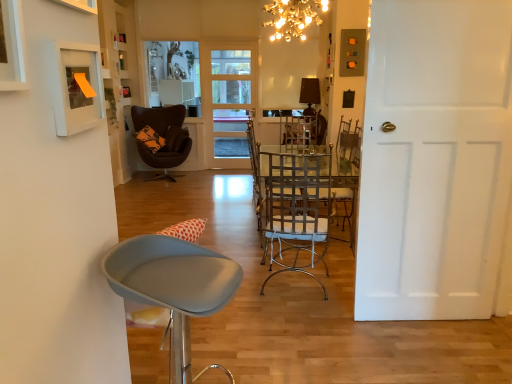
Question: Considering the relative positions of dark brown leather chair at center, which is counted as the first chair, starting from the back, and metallic silver chair at center, which ranks as the second chair in back-to-front order, in the image provided, is dark brown leather chair at center, which is counted as the first chair, starting from the back, to the right of metallic silver chair at center, which ranks as the second chair in back-to-front order, from the viewer's perspective?

Choices:
 (A) yes
 (B) no

Answer: (B)

Question: Does dark brown leather chair at center, which is the third chair from right to left, turn towards metallic silver chair at center, which ranks as the second chair in back-to-front order?

Choices:
 (A) yes
 (B) no

Answer: (A)

Question: Is dark brown leather chair at center, the 1th chair from the left, with metallic silver chair at center, the first chair positioned from the right?

Choices:
 (A) yes
 (B) no

Answer: (B)

Question: From the image's perspective, would you say dark brown leather chair at center, which is counted as the first chair, starting from the back, is shown under metallic silver chair at center, which ranks as the second chair in back-to-front order?

Choices:
 (A) yes
 (B) no

Answer: (B)

Question: Considering the relative positions of dark brown leather chair at center, the third chair in the front-to-back sequence, and metallic silver chair at center, which ranks as the 2th chair in front-to-back order, in the image provided, is dark brown leather chair at center, the third chair in the front-to-back sequence, in front of metallic silver chair at center, which ranks as the 2th chair in front-to-back order,?

Choices:
 (A) no
 (B) yes

Answer: (A)

Question: Is metallic switch plate at upper right, the 1th picture frame when ordered from top to bottom, in front of or behind white matte door at right, arranged as the 1th door when viewed from the front, in the image?

Choices:
 (A) front
 (B) behind

Answer: (B)

Question: Considering the positions of metallic switch plate at upper right, the 1th picture frame when ordered from top to bottom, and white matte door at right, arranged as the 1th door when viewed from the front, in the image, is metallic switch plate at upper right, the 1th picture frame when ordered from top to bottom, taller or shorter than white matte door at right, arranged as the 1th door when viewed from the front,?

Choices:
 (A) tall
 (B) short

Answer: (B)

Question: Is point (x=354, y=66) closer or farther from the camera than point (x=477, y=299)?

Choices:
 (A) closer
 (B) farther

Answer: (B)

Question: From a real-world perspective, is metallic switch plate at upper right, the 3th picture frame from the bottom, positioned above or below white matte door at right, which is counted as the 2th door, starting from the left?

Choices:
 (A) above
 (B) below

Answer: (A)

Question: Visually, is dark brown leather chair at center, which is the third chair from right to left, positioned to the left or to the right of white matte picture frame at upper left, the 2th picture frame in the right-to-left sequence?

Choices:
 (A) right
 (B) left

Answer: (B)

Question: Looking at their shapes, would you say dark brown leather chair at center, the 1th chair from the left, is wider or thinner than white matte picture frame at upper left, the 2th picture frame in the right-to-left sequence?

Choices:
 (A) wide
 (B) thin

Answer: (A)

Question: Does point (159, 135) appear closer or farther from the camera than point (62, 92)?

Choices:
 (A) closer
 (B) farther

Answer: (B)

Question: Relative to white matte picture frame at upper left, which is counted as the 2th picture frame, starting from the left, is dark brown leather chair at center, the third chair in the front-to-back sequence, in front or behind?

Choices:
 (A) front
 (B) behind

Answer: (B)

Question: From their relative heights in the image, would you say white matte picture frame at upper left, placed as the 2th picture frame when sorted from bottom to top, is taller or shorter than white matte door at right, which is counted as the 2th door, starting from the left?

Choices:
 (A) short
 (B) tall

Answer: (A)

Question: Considering their positions, is white matte picture frame at upper left, marked as the third picture frame in a back-to-front arrangement, located in front of or behind white matte door at right, which is counted as the 2th door, starting from the left?

Choices:
 (A) behind
 (B) front

Answer: (B)